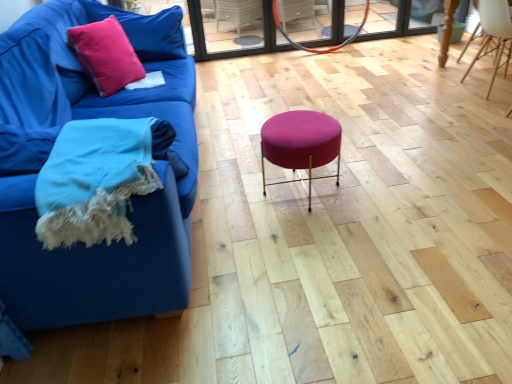
Question: Does pink velvet pillow at upper left have a greater height compared to woolen blue blanket at lower left?

Choices:
 (A) no
 (B) yes

Answer: (B)

Question: Is pink velvet pillow at upper left located outside woolen blue blanket at lower left?

Choices:
 (A) no
 (B) yes

Answer: (B)

Question: Does pink velvet pillow at upper left have a lesser height compared to woolen blue blanket at lower left?

Choices:
 (A) yes
 (B) no

Answer: (B)

Question: From the image's perspective, is pink velvet pillow at upper left above woolen blue blanket at lower left?

Choices:
 (A) yes
 (B) no

Answer: (A)

Question: Is pink velvet pillow at upper left to the left of woolen blue blanket at lower left from the viewer's perspective?

Choices:
 (A) no
 (B) yes

Answer: (B)

Question: Is matte pink cushion at upper left to the left or to the right of matte pink fabric stool at center in the image?

Choices:
 (A) left
 (B) right

Answer: (A)

Question: In terms of width, does matte pink cushion at upper left look wider or thinner when compared to matte pink fabric stool at center?

Choices:
 (A) thin
 (B) wide

Answer: (A)

Question: Is matte pink cushion at upper left in front of or behind matte pink fabric stool at center in the image?

Choices:
 (A) front
 (B) behind

Answer: (B)

Question: Considering the positions of matte pink cushion at upper left and matte pink fabric stool at center in the image, is matte pink cushion at upper left bigger or smaller than matte pink fabric stool at center?

Choices:
 (A) small
 (B) big

Answer: (A)

Question: From a real-world perspective, relative to white wood chair at upper right, is matte pink fabric stool at center vertically above or below?

Choices:
 (A) below
 (B) above

Answer: (A)

Question: Looking at their shapes, would you say matte pink fabric stool at center is wider or thinner than white wood chair at upper right?

Choices:
 (A) wide
 (B) thin

Answer: (B)

Question: From the image's perspective, relative to white wood chair at upper right, is matte pink fabric stool at center above or below?

Choices:
 (A) above
 (B) below

Answer: (B)

Question: Considering their positions, is matte pink fabric stool at center located in front of or behind white wood chair at upper right?

Choices:
 (A) behind
 (B) front

Answer: (B)

Question: Based on their sizes in the image, would you say white wood chair at upper right is bigger or smaller than matte pink fabric stool at center?

Choices:
 (A) small
 (B) big

Answer: (B)

Question: Is white wood chair at upper right inside or outside of matte pink fabric stool at center?

Choices:
 (A) outside
 (B) inside

Answer: (A)